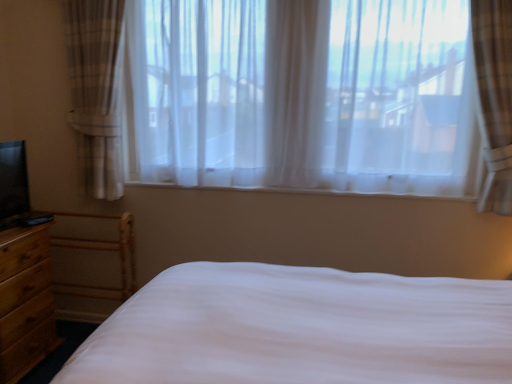
Question: From a real-world perspective, is brown wood nightstand at lower left positioned above or below sheer white curtains at center?

Choices:
 (A) above
 (B) below

Answer: (B)

Question: Is brown wood nightstand at lower left bigger or smaller than sheer white curtains at center?

Choices:
 (A) big
 (B) small

Answer: (B)

Question: From the image's perspective, is brown wood nightstand at lower left located above or below sheer white curtains at center?

Choices:
 (A) above
 (B) below

Answer: (B)

Question: Do you think sheer white curtains at center is within brown wood nightstand at lower left, or outside of it?

Choices:
 (A) outside
 (B) inside

Answer: (A)

Question: From the image's perspective, is sheer white curtains at center above or below brown wood nightstand at lower left?

Choices:
 (A) above
 (B) below

Answer: (A)

Question: Considering the relative positions of sheer white curtains at center and brown wood nightstand at lower left in the image provided, is sheer white curtains at center to the left or to the right of brown wood nightstand at lower left?

Choices:
 (A) right
 (B) left

Answer: (A)

Question: Looking at the image, does sheer white curtains at center seem bigger or smaller compared to brown wood nightstand at lower left?

Choices:
 (A) small
 (B) big

Answer: (B)